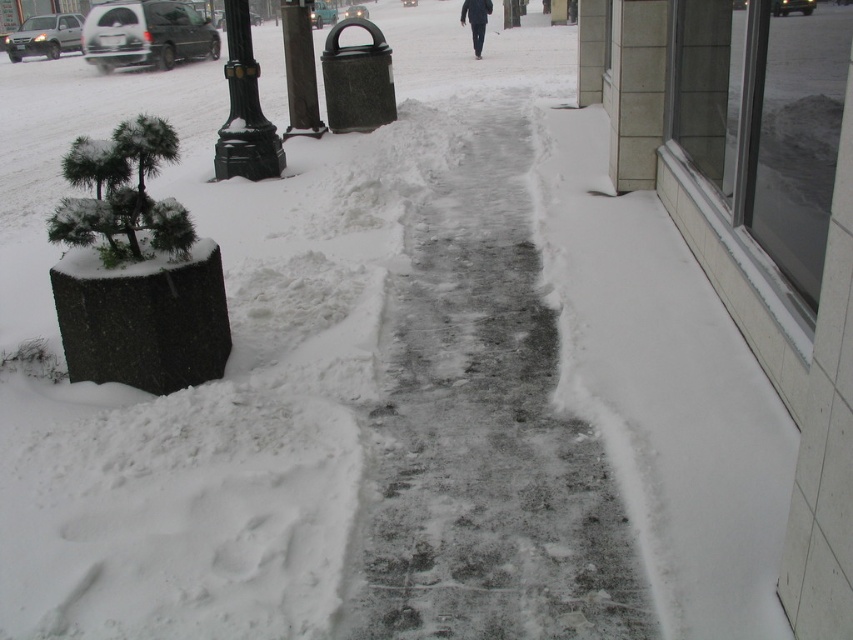
Question: Where is icey concrete path at center located in relation to sanded concrete pole at center in the image?

Choices:
 (A) above
 (B) below

Answer: (B)

Question: Is black cast iron pole at center closer to camera compared to black matte pants at center?

Choices:
 (A) no
 (B) yes

Answer: (B)

Question: Does black cast iron pole at center appear over black matte pants at center?

Choices:
 (A) no
 (B) yes

Answer: (A)

Question: Among these objects, which one is farthest from the camera?

Choices:
 (A) sanded concrete pole at center
 (B) icey concrete path at center
 (C) black cast iron pole at center

Answer: (A)

Question: Which of the following is the farthest from the observer?

Choices:
 (A) (280, 16)
 (B) (445, 500)

Answer: (A)

Question: Which object is the farthest from the black cast iron pole at center?

Choices:
 (A) black matte pants at center
 (B) sanded concrete pole at center
 (C) icey concrete path at center

Answer: (A)